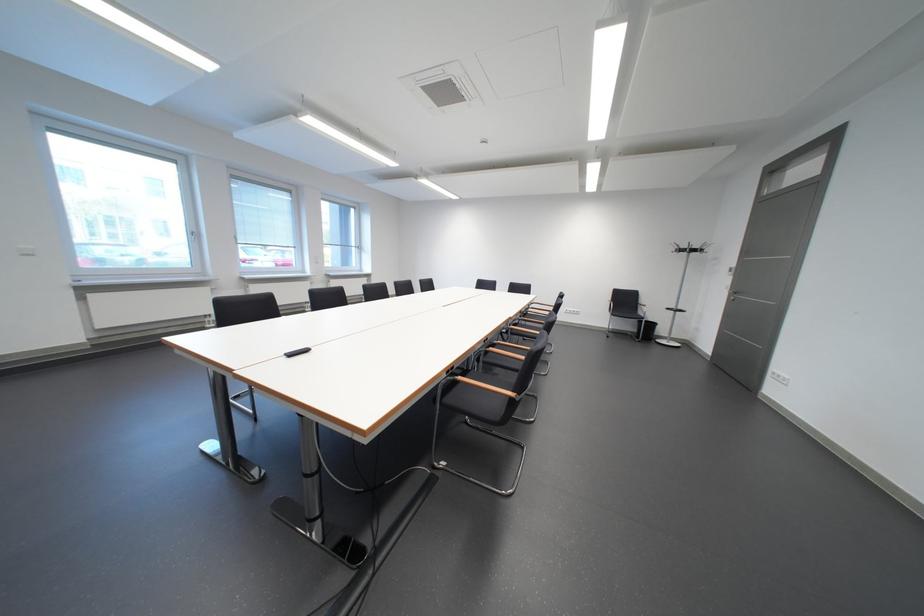
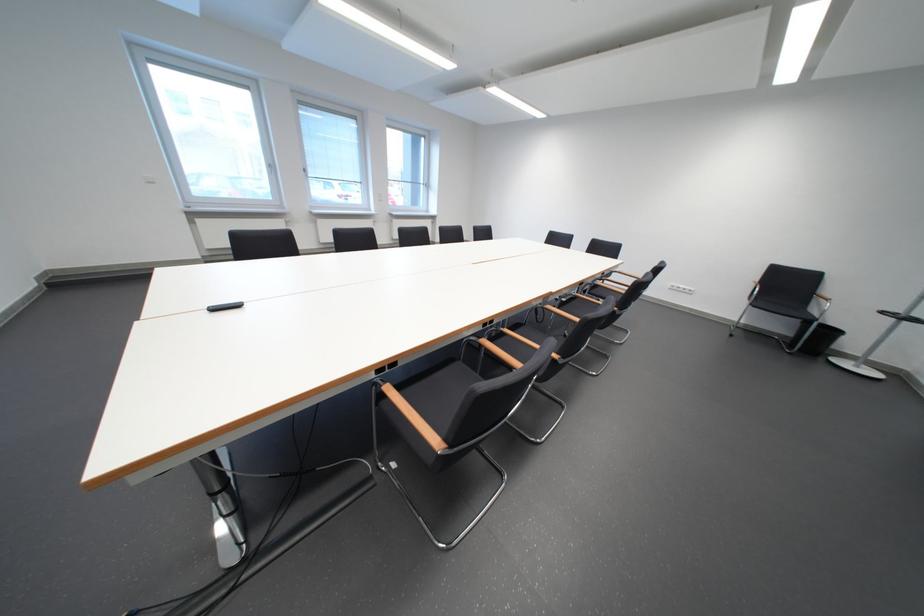
The images are taken continuously from a first-person perspective. In which direction are you moving?

The cameraman walked toward right, forward.